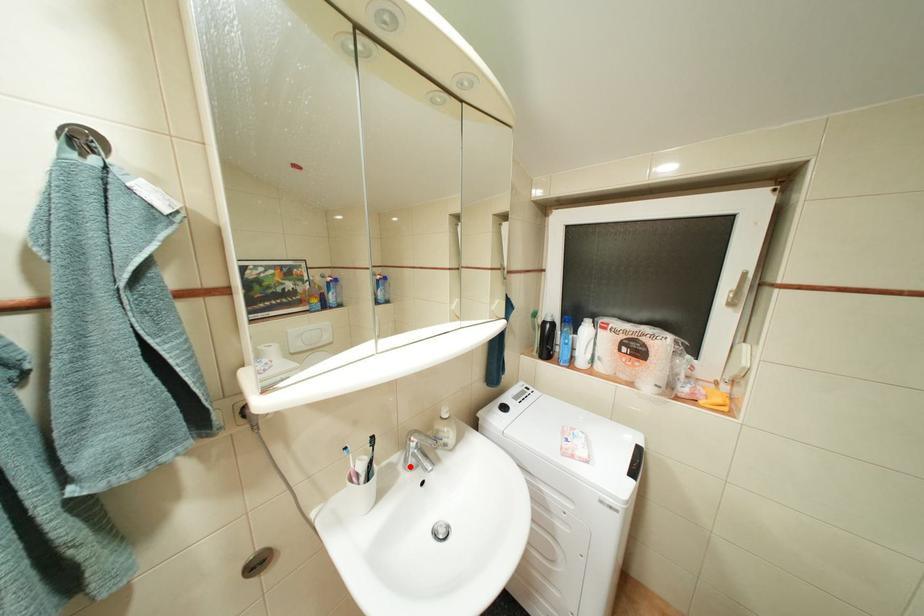
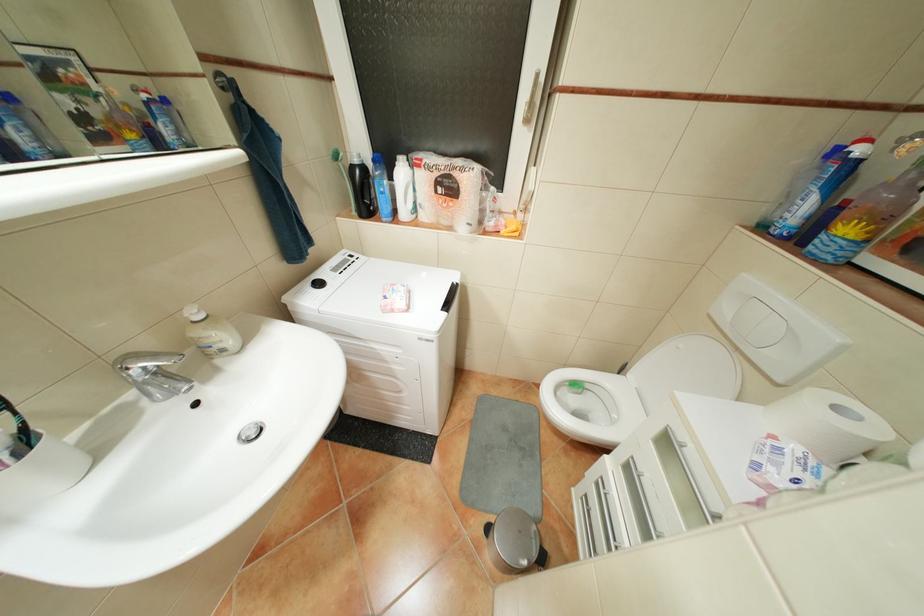
The point at the highlighted location is marked in the first image. Where is the corresponding point in the second image?

(154, 400)